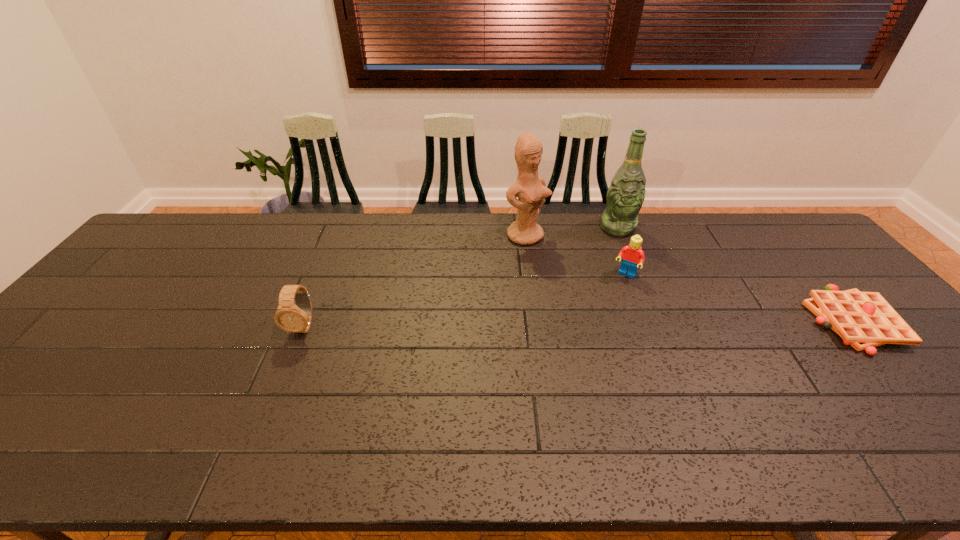
Identify the location of watch. (292, 318).

This screenshot has height=540, width=960. In order to click on waffle in this screenshot , I will do `click(864, 320)`.

Locate an element on the screen. the shortest object is located at coordinates (864, 320).

What are the coordinates of `the third nearest object` in the screenshot? It's located at (633, 254).

Where is `the fourth object from right to left`? Image resolution: width=960 pixels, height=540 pixels. the fourth object from right to left is located at coordinates (531, 190).

The height and width of the screenshot is (540, 960). I want to click on beer bottle, so 625,196.

You are a GUI agent. You are given a task and a screenshot of the screen. Output one action in this format:
    pyautogui.click(x=<x>, y=<y>)
    Task: Click on the vacant space located on the face of the watch
    The height and width of the screenshot is (540, 960).
    Given the screenshot: What is the action you would take?
    pyautogui.click(x=282, y=379)

You are a GUI agent. You are given a task and a screenshot of the screen. Output one action in this format:
    pyautogui.click(x=<x>, y=<y>)
    Task: Click on the blank area located on the front of the rightmost object
    
    Given the screenshot: What is the action you would take?
    pyautogui.click(x=932, y=410)

This screenshot has width=960, height=540. Identify the location of vacant region located on the face of the third farthest object. (612, 300).

Where is `vacant space located 0.110m on the face of the third farthest object`? The height and width of the screenshot is (540, 960). vacant space located 0.110m on the face of the third farthest object is located at coordinates [x=610, y=304].